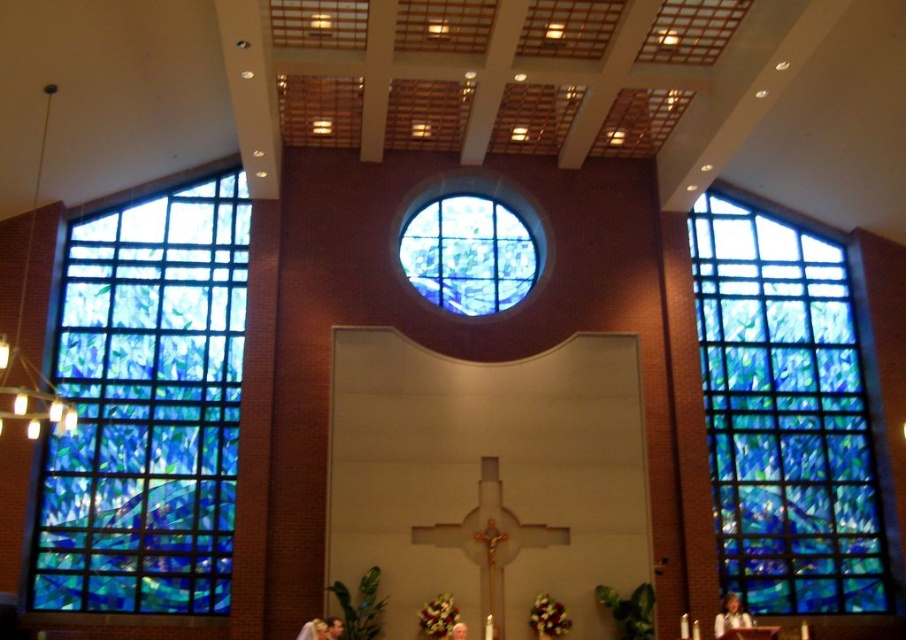
Question: Which point is closer to the camera?

Choices:
 (A) (498, 204)
 (B) (201, 506)

Answer: (B)

Question: Which point is farther to the camera?

Choices:
 (A) (467, 272)
 (B) (721, 244)

Answer: (B)

Question: Does blue stained glass window at right come behind blue stained glass window at center?

Choices:
 (A) yes
 (B) no

Answer: (B)

Question: Which point is farther to the camera?

Choices:
 (A) (136, 557)
 (B) (474, 308)
 (C) (770, 428)

Answer: (C)

Question: Can you confirm if stained glass window at left is positioned below blue stained glass window at center?

Choices:
 (A) no
 (B) yes

Answer: (B)

Question: Does stained glass window at left have a lesser width compared to blue stained glass window at center?

Choices:
 (A) no
 (B) yes

Answer: (A)